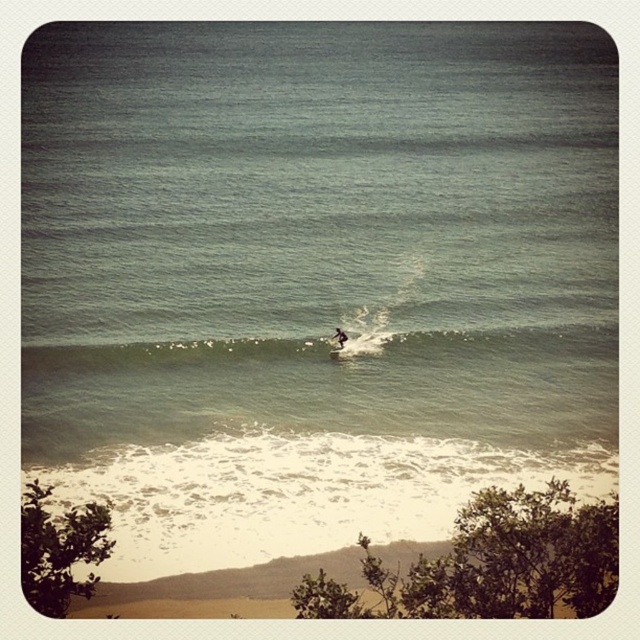
Who is taller, white foam wave at center or white matte surfboard at center?

white foam wave at center

The width and height of the screenshot is (640, 640). What do you see at coordinates (500, 348) in the screenshot? I see `white foam wave at center` at bounding box center [500, 348].

I want to click on white foam wave at center, so click(500, 348).

Which is below, white foam wave at center or white foam surfboard at center?

white foam surfboard at center is lower down.

Does white foam wave at center have a lesser width compared to white foam surfboard at center?

In fact, white foam wave at center might be wider than white foam surfboard at center.

Is point (26, 358) closer to viewer compared to point (333, 358)?

Yes, it is in front of point (333, 358).

The width and height of the screenshot is (640, 640). I want to click on white foam wave at center, so click(x=500, y=348).

Can you confirm if white matte surfboard at center is positioned below white foam surfboard at center?

Actually, white matte surfboard at center is above white foam surfboard at center.

In order to click on white matte surfboard at center in this screenshot , I will do `click(339, 337)`.

Locate an element on the screen. The height and width of the screenshot is (640, 640). white matte surfboard at center is located at coordinates (339, 337).